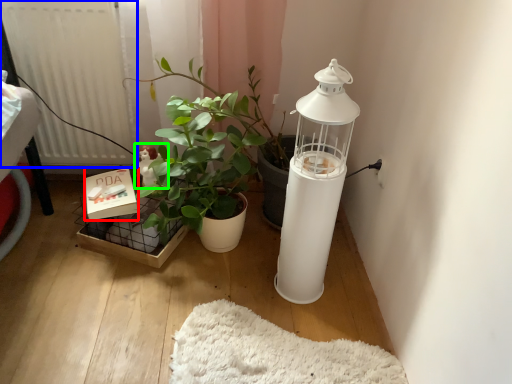
Question: Considering the real-world distances, which object is farthest from box (highlighted by a red box)? radiator (highlighted by a blue box) or toy (highlighted by a green box)?

Choices:
 (A) radiator
 (B) toy

Answer: (A)